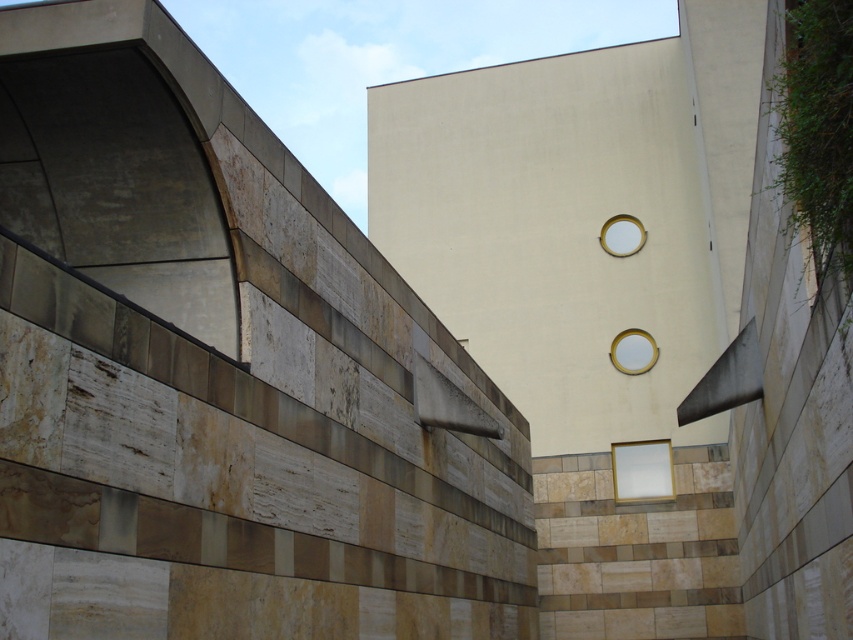
Can you confirm if matte gold circle at center is positioned to the left of matte gold circle at upper center?

In fact, matte gold circle at center is to the right of matte gold circle at upper center.

Who is lower down, matte gold circle at center or matte gold circle at upper center?

matte gold circle at center is lower down.

Does point (647, 333) lie behind point (636, 243)?

No, it is not.

Locate an element on the screen. The image size is (853, 640). matte gold circle at center is located at coordinates (633, 352).